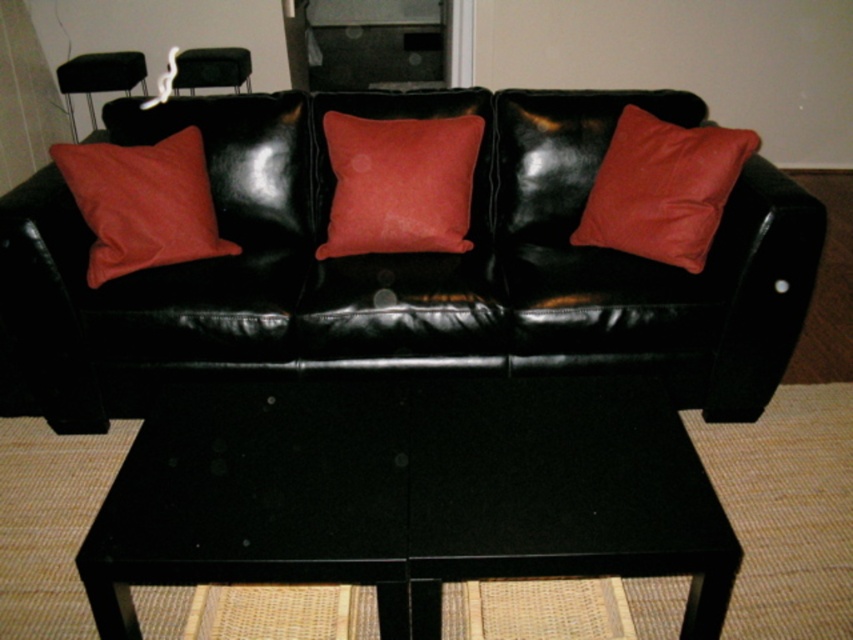
Question: Considering the relative positions of black leather couch at center and velvet red pillow at right in the image provided, where is black leather couch at center located with respect to velvet red pillow at right?

Choices:
 (A) above
 (B) below

Answer: (B)

Question: Does matte red pillow at left have a smaller size compared to matte black chair at upper left?

Choices:
 (A) no
 (B) yes

Answer: (B)

Question: Which object is closer to the camera taking this photo?

Choices:
 (A) matte red pillow at left
 (B) suede-like coral cushion at center
 (C) black glossy table at center
 (D) velvet red pillow at right

Answer: (C)

Question: Which point is farther to the camera?

Choices:
 (A) (463, 568)
 (B) (456, 172)
 (C) (73, 83)

Answer: (C)

Question: Is velvet red pillow at right further to the viewer compared to matte red pillow at left?

Choices:
 (A) yes
 (B) no

Answer: (B)

Question: Which object appears farthest from the camera in this image?

Choices:
 (A) suede-like coral cushion at center
 (B) velvet red pillow at right
 (C) black glossy table at center
 (D) black leather couch at center

Answer: (A)